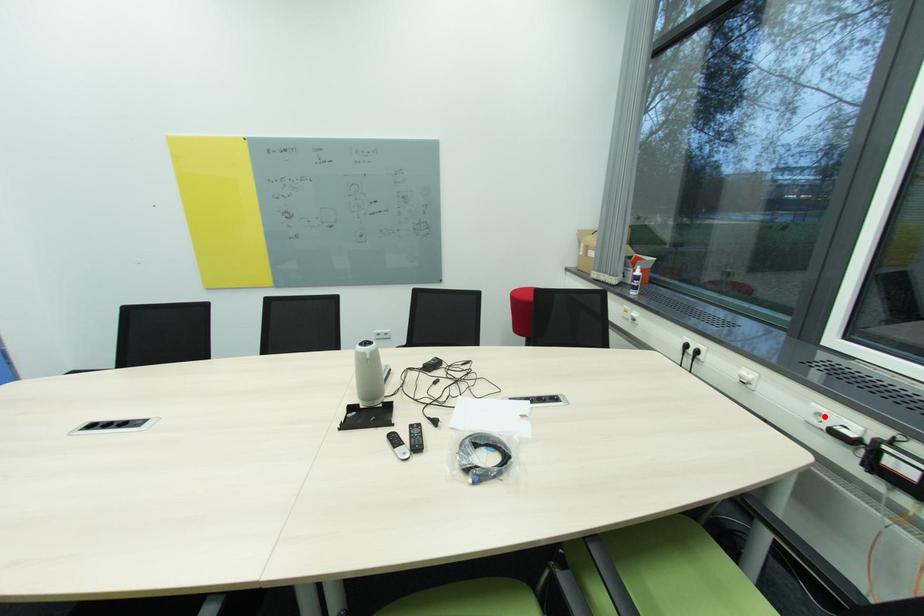
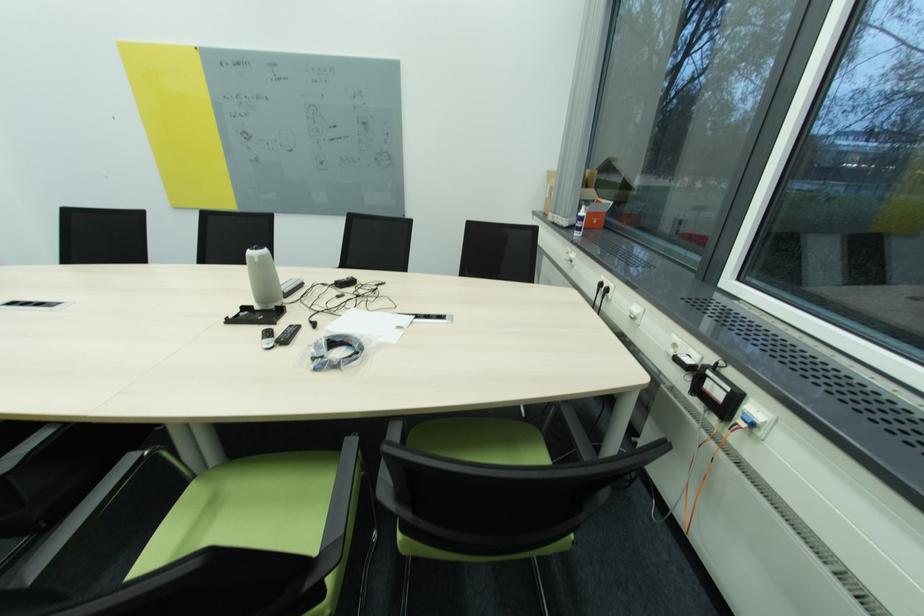
In the second image, find the point that corresponds to the highlighted location in the first image.

(679, 346)